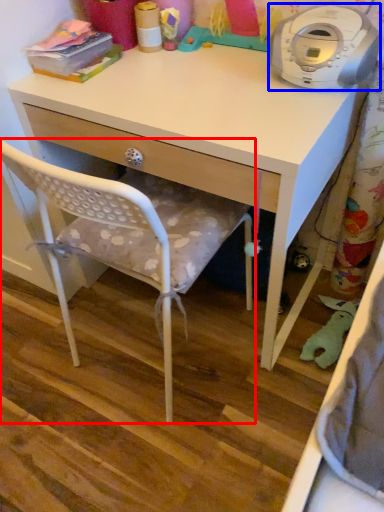
Question: Which of the following is the farthest to the observer, chair (highlighted by a red box) or home appliance (highlighted by a blue box)?

Choices:
 (A) chair
 (B) home appliance

Answer: (B)